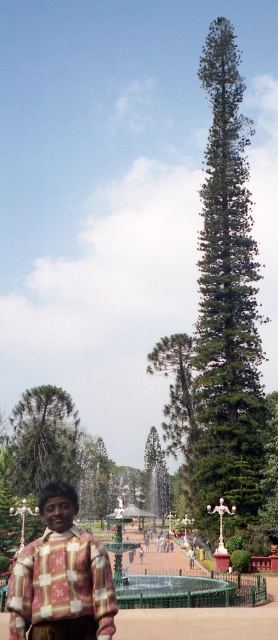
You are standing at the camera position and want to walk directly to the green textured pine tree at center. How many steps would you need to take if each step covers approximately 0.75 meters?

The distance between you and the green textured pine tree at center is 55.55 meters. Dividing this by the step length of 0.75 meters gives approximately 74 steps. Therefore, you would need around 74 steps to reach the green textured pine tree at center.

You are a photographer trying to capture both the plaid fabric shirt at lower left and the green matte tree at center in a single frame. Based on their heights, which object will appear larger in the photo?

The green matte tree at center will appear larger in the photo because it is taller than the plaid fabric shirt at lower left.

You are a photographer trying to capture the green textured pine tree at center and the green matte tree at center in a single shot. Which tree should you focus on first if you want to ensure both are in focus?

You should focus on the green textured pine tree at center first because it is above the green matte tree at center, making it closer to the camera.